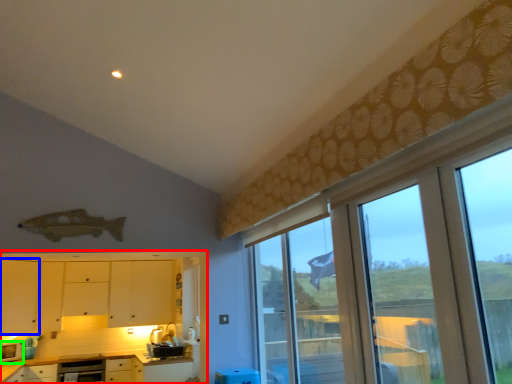
Question: Which object is the closest to the cabinetry (highlighted by a red box)? Choose among these: cabinetry (highlighted by a blue box) or appliance (highlighted by a green box).

Choices:
 (A) cabinetry
 (B) appliance

Answer: (A)